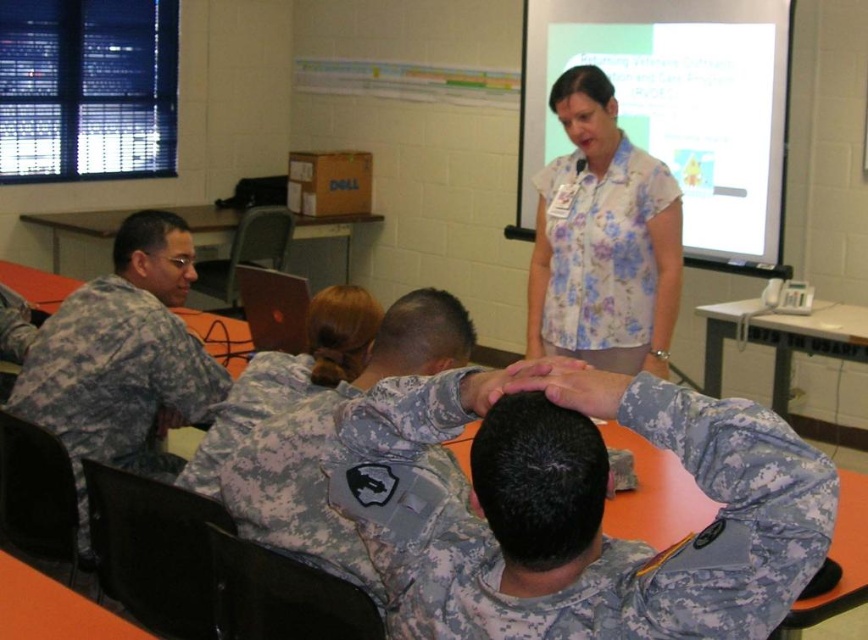
Who is more distant from viewer, (559, 186) or (251, 440)?

Point (559, 186)

This screenshot has height=640, width=868. Identify the location of floral print blouse at upper center. (603, 240).

Is camouflage uniform at left thinner than floral print blouse at upper center?

No.

Is point (158, 368) less distant than point (571, 307)?

Yes, point (158, 368) is closer to viewer.

Which is behind, point (176, 337) or point (628, 314)?

The point (628, 314) is behind.

Where is `camouflage uniform at left`? The height and width of the screenshot is (640, 868). camouflage uniform at left is located at coordinates (122, 360).

Is camouflage uniform at center wider than floral print blouse at upper center?

Indeed, camouflage uniform at center has a greater width compared to floral print blouse at upper center.

Is camouflage uniform at center in front of floral print blouse at upper center?

Yes, camouflage uniform at center is in front of floral print blouse at upper center.

At what (x,y) coordinates should I click in order to perform the action: click on camouflage uniform at center. Please return your answer as a coordinate pair (x, y). This screenshot has height=640, width=868. Looking at the image, I should click on (582, 515).